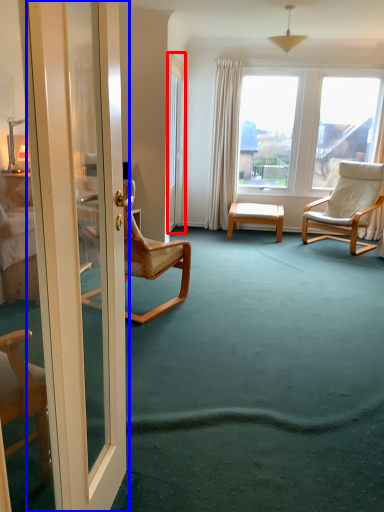
Question: Among these objects, which one is farthest to the camera, glass door (highlighted by a red box) or door (highlighted by a blue box)?

Choices:
 (A) glass door
 (B) door

Answer: (A)